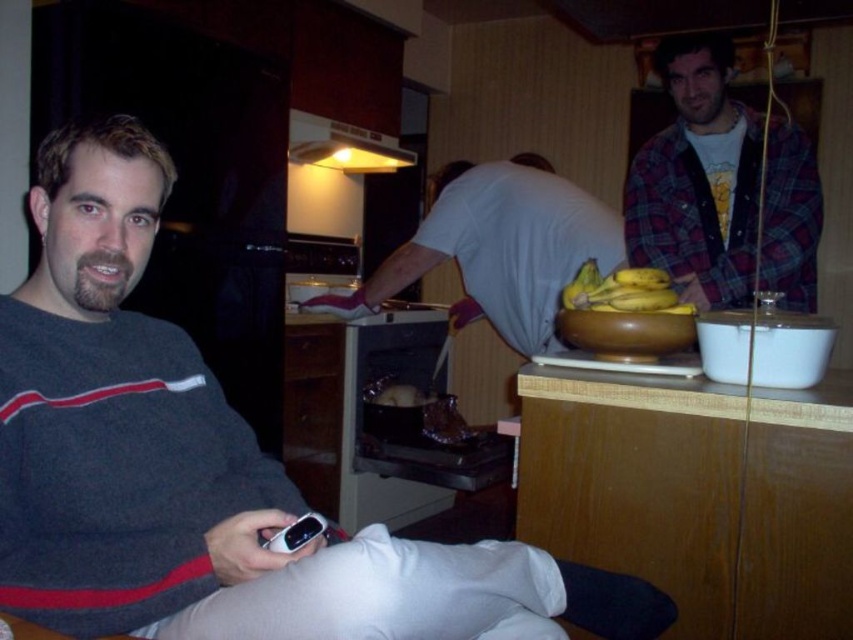
Question: In this image, where is gray striped sweater at left located relative to yellow matte bananas at upper right?

Choices:
 (A) right
 (B) left

Answer: (B)

Question: Among these objects, which one is nearest to the camera?

Choices:
 (A) white matte shirt at center
 (B) yellow matte bananas at upper right
 (C) flannel shirt at upper right

Answer: (B)

Question: Does gray striped sweater at left have a greater width compared to yellow matte bananas at upper right?

Choices:
 (A) no
 (B) yes

Answer: (B)

Question: Does flannel shirt at upper right have a greater width compared to white matte shirt at center?

Choices:
 (A) no
 (B) yes

Answer: (A)

Question: Considering the real-world distances, which object is farthest from the white matte shirt at center?

Choices:
 (A) gray striped sweater at left
 (B) flannel shirt at upper right

Answer: (A)

Question: Among these objects, which one is farthest from the camera?

Choices:
 (A) yellow matte bananas at upper right
 (B) gray striped sweater at left
 (C) white matte shirt at center
 (D) flannel shirt at upper right

Answer: (C)